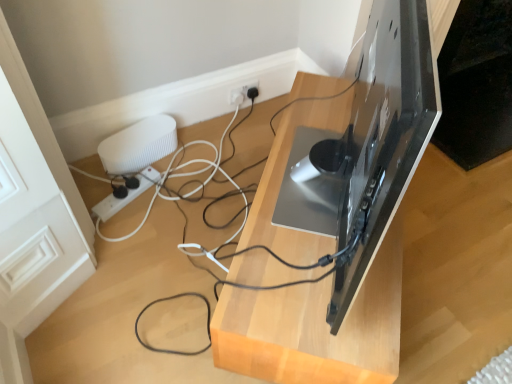
Find the location of `vacant area located to the right-hand side of white plastic power strip at lower left`. vacant area located to the right-hand side of white plastic power strip at lower left is located at coordinates [170, 204].